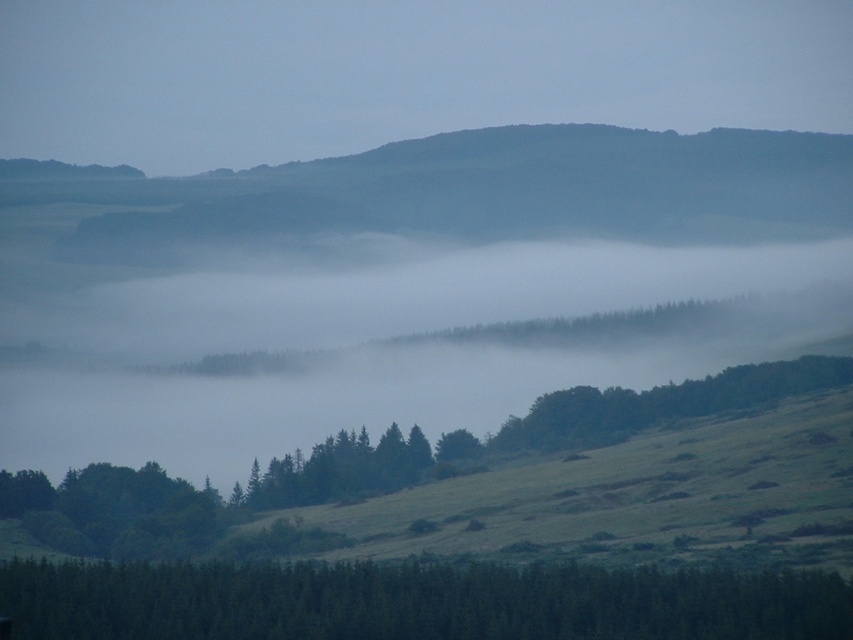
Question: Can you confirm if green matte tree at lower center is positioned to the left of green matte tree at lower left?

Choices:
 (A) yes
 (B) no

Answer: (B)

Question: From the image, what is the correct spatial relationship of green matte tree at lower center in relation to green matte tree at lower left?

Choices:
 (A) below
 (B) above

Answer: (A)

Question: Which point is closer to the camera?

Choices:
 (A) tap(670, 624)
 (B) tap(86, 550)

Answer: (A)

Question: Which point is closer to the camera?

Choices:
 (A) (167, 556)
 (B) (511, 595)

Answer: (B)

Question: Does green matte tree at lower center have a lesser width compared to green matte tree at lower left?

Choices:
 (A) no
 (B) yes

Answer: (A)

Question: Which object is farther from the camera taking this photo?

Choices:
 (A) green matte tree at lower center
 (B) green matte tree at lower left

Answer: (B)